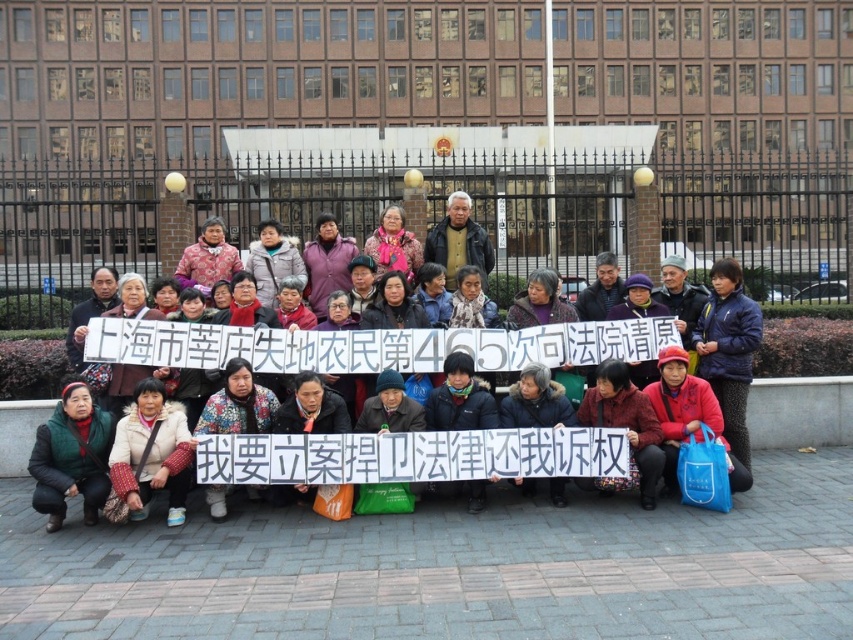
You are a photographer trying to capture a photo of the group while ensuring both the dark blue jacket at center and the blue fleece jacket at center are visible. Which jacket should you position to the left in your camera view to match their actual arrangement?

The dark blue jacket at center should be positioned to the left in your camera view because it is actually on the left side of the blue fleece jacket at center.

You are standing in front of the building and see two people wearing jackets. One has a dark blue jacket at center and the other has a dark gray jacket at center. Which jacket is closer to you?

The dark blue jacket at center is closer to the viewer than the dark gray jacket at center.